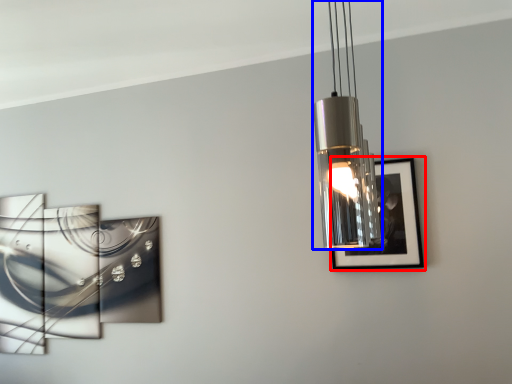
Question: Among these objects, which one is farthest to the camera, picture frame (highlighted by a red box) or lamp (highlighted by a blue box)?

Choices:
 (A) picture frame
 (B) lamp

Answer: (A)